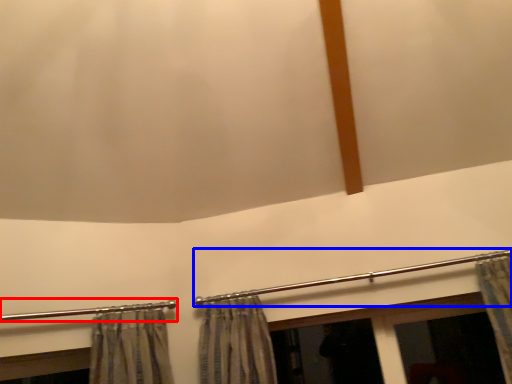
Question: Which object is closer to the camera taking this photo, clothesline (highlighted by a red box) or clothesline (highlighted by a blue box)?

Choices:
 (A) clothesline
 (B) clothesline

Answer: (A)